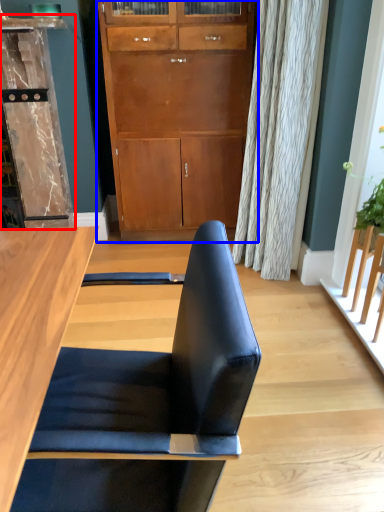
Question: Which point is further to the camera, dresser (highlighted by a red box) or cabinetry (highlighted by a blue box)?

Choices:
 (A) dresser
 (B) cabinetry

Answer: (B)